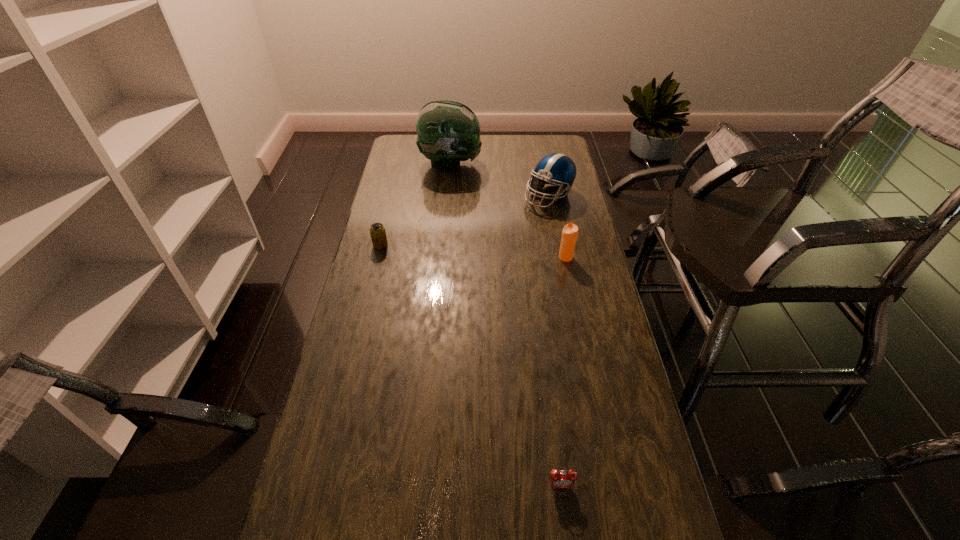
Where is `free spot located 0.330m on the back of the candle`? This screenshot has height=540, width=960. free spot located 0.330m on the back of the candle is located at coordinates (554, 199).

Where is `vacant point located on the back of the leftmost object`? vacant point located on the back of the leftmost object is located at coordinates (394, 191).

Identify the location of vacant region located 0.090m on the face of the alarm clock. This screenshot has width=960, height=540. (566, 535).

This screenshot has width=960, height=540. What are the coordinates of `object located in the far edge section of the desktop` in the screenshot? It's located at (448, 132).

Locate an element on the screen. football helmet positioned at the left edge is located at coordinates (448, 132).

The width and height of the screenshot is (960, 540). Identify the location of beer can located at the left edge. (377, 231).

Where is `football helmet that is positioned at the right edge`? This screenshot has height=540, width=960. football helmet that is positioned at the right edge is located at coordinates (556, 169).

Where is `candle that is at the right edge`? This screenshot has height=540, width=960. candle that is at the right edge is located at coordinates (570, 231).

Where is `object at the far left corner`? object at the far left corner is located at coordinates (448, 132).

This screenshot has height=540, width=960. Find the location of `free region at the far edge of the desktop`. free region at the far edge of the desktop is located at coordinates (487, 145).